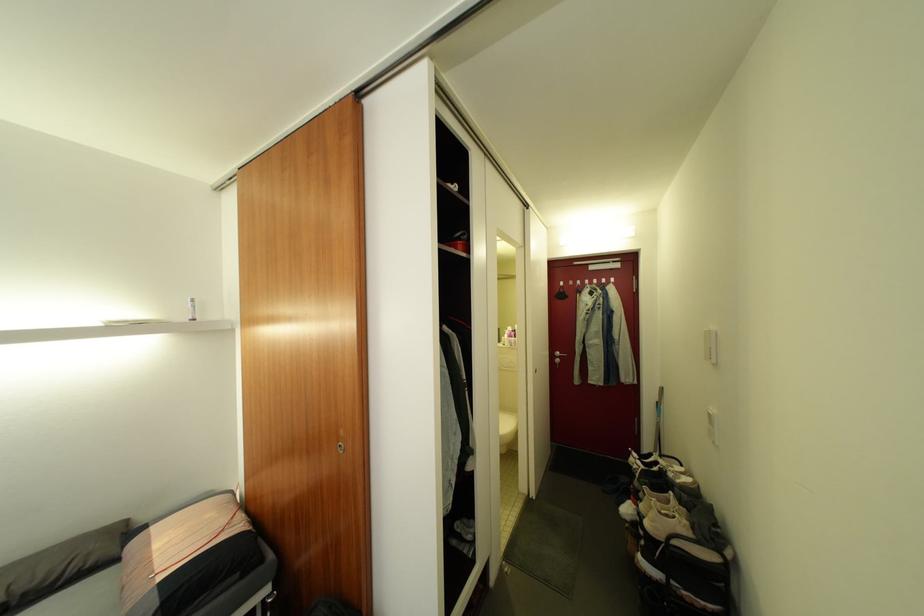
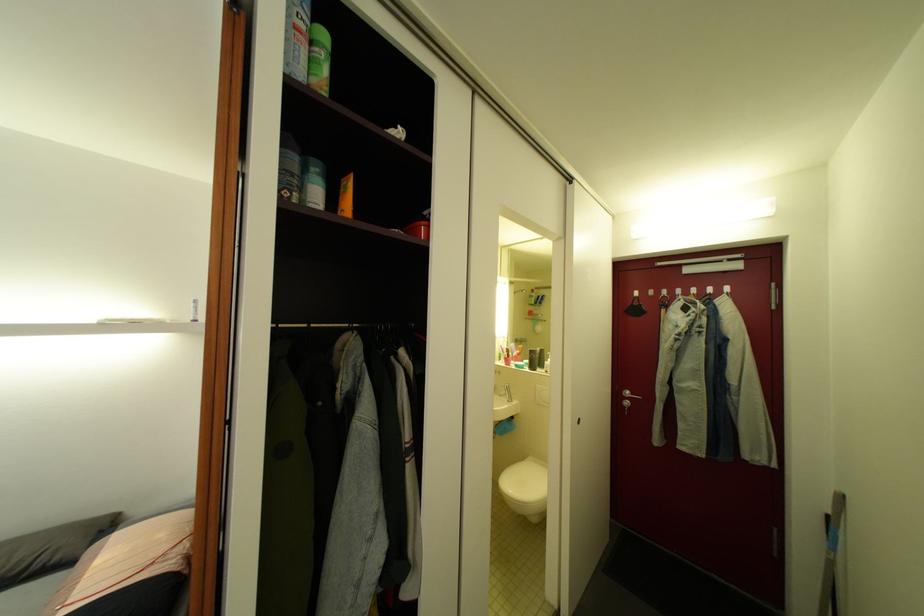
What movement of the cameraman would produce the second image?

The movement direction of the cameraman is right, forward.